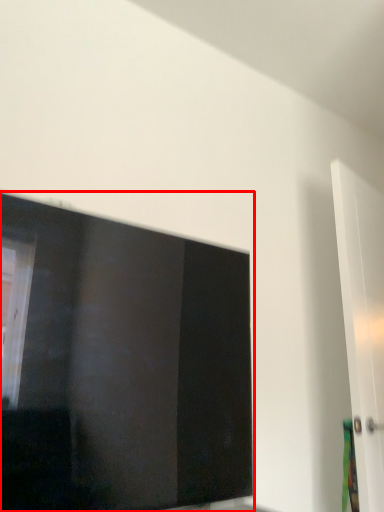
Question: From the image, what is the correct spatial relationship of window (annotated by the red box) in relation to door?

Choices:
 (A) left
 (B) right

Answer: (A)